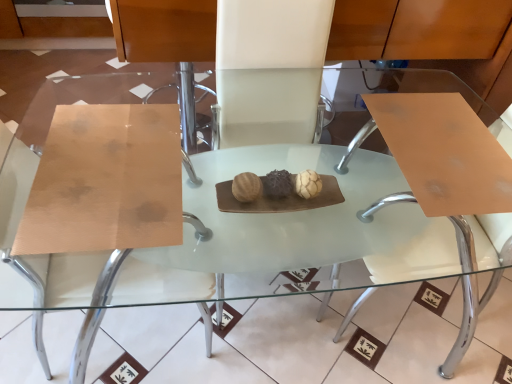
Question: From a real-world perspective, relative to matte brown swivel chair at right, is matte wood chair at center, which appears as the 2th chair when viewed from the right, vertically above or below?

Choices:
 (A) below
 (B) above

Answer: (B)

Question: Looking at the image, does matte wood chair at center, which appears as the 1th chair when viewed from the left, seem bigger or smaller compared to matte brown swivel chair at right?

Choices:
 (A) big
 (B) small

Answer: (A)

Question: Considering the real-world distances, which object is farthest from the matte brown swivel chair at right?

Choices:
 (A) matte wood chair at center, which appears as the 1th chair when viewed from the left
 (B) white leather chair at center, which is the 1th chair in right-to-left order

Answer: (A)

Question: Considering the real-world distances, which object is closest to the matte wood chair at center, which appears as the 1th chair when viewed from the left?

Choices:
 (A) matte brown swivel chair at right
 (B) white leather chair at center, which is the 1th chair in right-to-left order

Answer: (B)